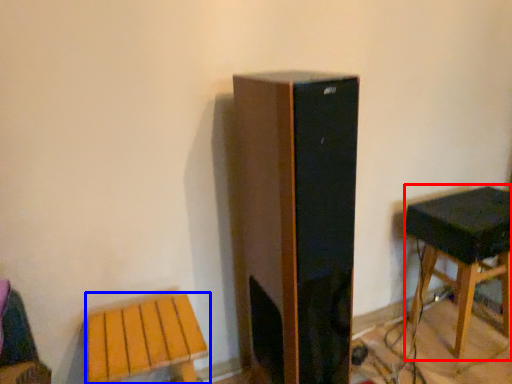
Question: Among these objects, which one is farthest to the camera, stool (highlighted by a red box) or stool (highlighted by a blue box)?

Choices:
 (A) stool
 (B) stool

Answer: (A)